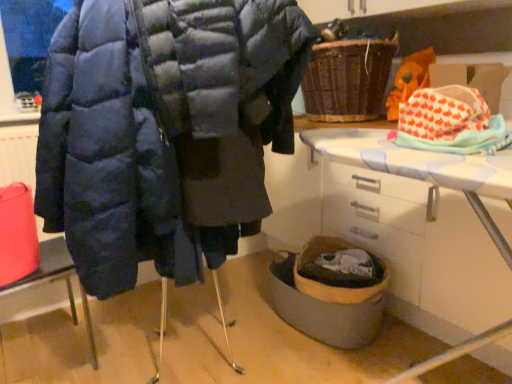
Question: From the image's perspective, would you say woven brown basket at upper center is shown under matte blue puffer jacket at center?

Choices:
 (A) no
 (B) yes

Answer: (A)

Question: From a real-world perspective, is woven brown basket at upper center on top of matte blue puffer jacket at center?

Choices:
 (A) no
 (B) yes

Answer: (B)

Question: Does woven brown basket at upper center touch matte blue puffer jacket at center?

Choices:
 (A) yes
 (B) no

Answer: (B)

Question: Is woven brown basket at upper center behind matte blue puffer jacket at center?

Choices:
 (A) no
 (B) yes

Answer: (B)

Question: Is matte blue puffer jacket at center a part of woven brown basket at upper center?

Choices:
 (A) yes
 (B) no

Answer: (B)

Question: Does woven brown basket at upper center lie in front of matte blue puffer jacket at center?

Choices:
 (A) yes
 (B) no

Answer: (B)

Question: Is woven brown basket at upper center smaller than matte black coat at left?

Choices:
 (A) no
 (B) yes

Answer: (B)

Question: Is woven brown basket at upper center thinner than matte black coat at left?

Choices:
 (A) yes
 (B) no

Answer: (B)

Question: Is woven brown basket at upper center positioned in front of matte black coat at left?

Choices:
 (A) no
 (B) yes

Answer: (A)

Question: Are woven brown basket at upper center and matte black coat at left far apart?

Choices:
 (A) no
 (B) yes

Answer: (B)

Question: Is woven brown basket at upper center facing away from matte black coat at left?

Choices:
 (A) yes
 (B) no

Answer: (B)

Question: Can you confirm if woven brown basket at upper center is positioned to the left of matte black coat at left?

Choices:
 (A) yes
 (B) no

Answer: (B)

Question: Can you confirm if matte black coat at left is bigger than white plastic table at lower right?

Choices:
 (A) no
 (B) yes

Answer: (A)